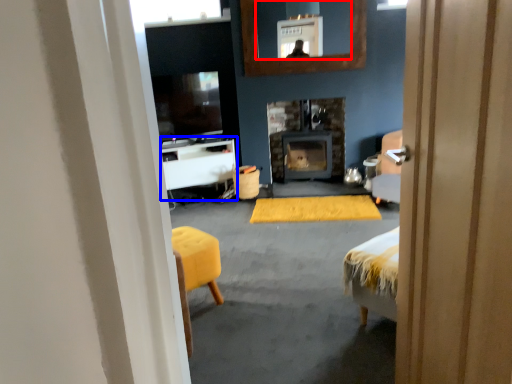
Question: Which of the following is the closest to the observer, mirror (highlighted by a red box) or table (highlighted by a blue box)?

Choices:
 (A) mirror
 (B) table

Answer: (A)